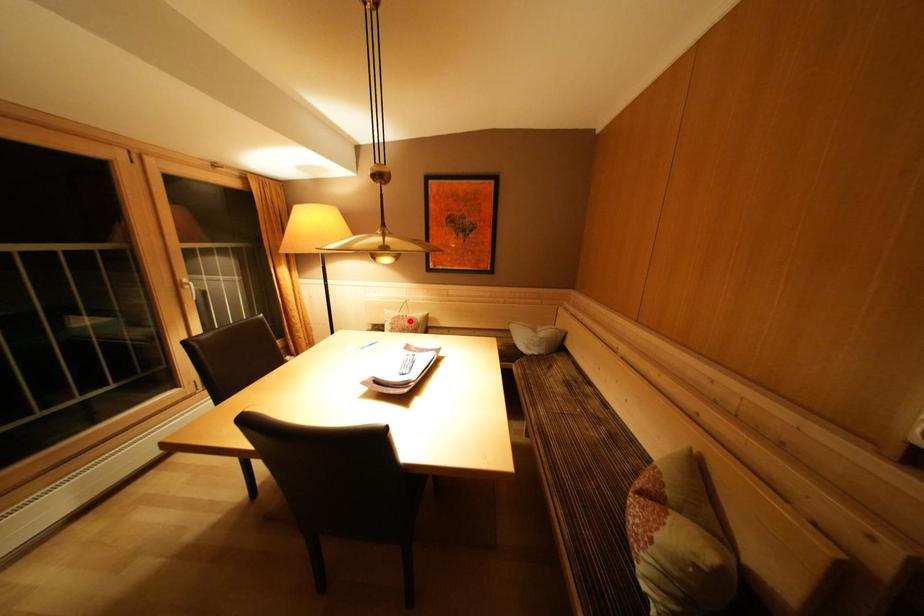
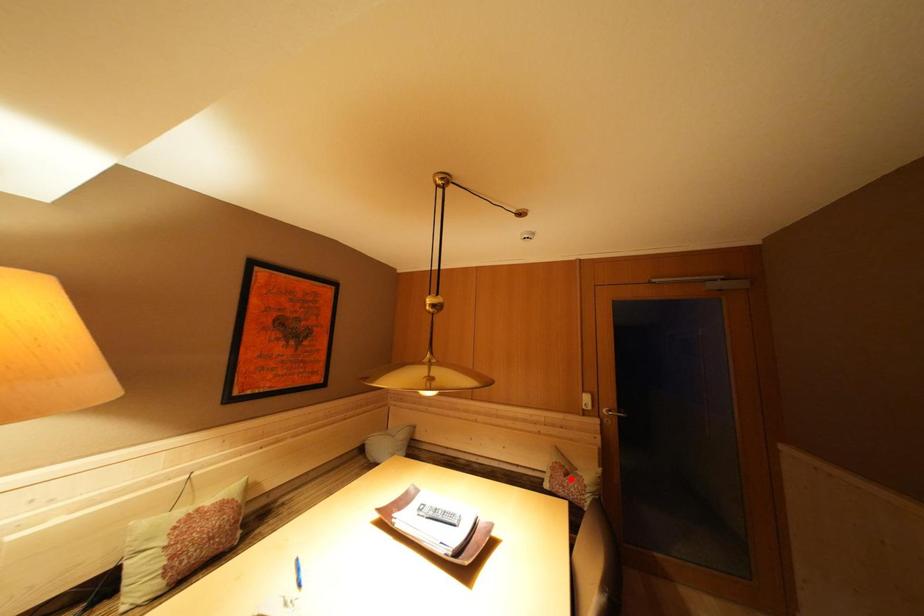
I am providing you with two images of the same scene from different viewpoints. A red point is marked on the first image and another point is marked on the second image. Are the points marked in image1 and image2 representing the same 3D position?

No